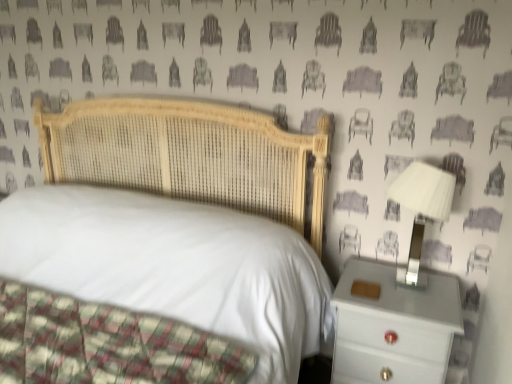
Find the location of a particular element. unoccupied area in front of white plastic lampshade at right is located at coordinates (425, 309).